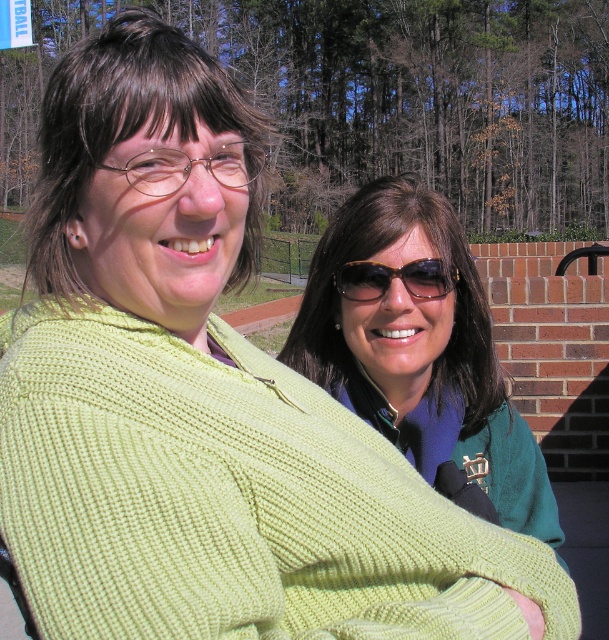
You are a photographer trying to capture a group photo of the two people in the image. The camera you are using has a minimum focusing distance of 3 inches. Can you include both the green knitted sweater at center and the black reflective sunglasses at center in the same focused shot?

The distance between the green knitted sweater at center and the black reflective sunglasses at center is 3.06 inches, which exceeds the camera minimum focusing distance of 3 inches. Therefore, both can be included in the focused shot.

You are a photographer adjusting your camera settings to capture the best shot of the green knitted sweater at center. The camera has a focal length of 50mm and an aperture of f2.8. To ensure the sweater is in sharp focus, what distance should you set the focus ring to?

The green knitted sweater at center is 4.84 feet away from camera, so you should set the focus ring to 4.84 feet to ensure it is in sharp focus.

You are a photographer trying to capture a clear shot of the black reflective sunglasses at center. However, the green knitted sweater at center is blocking your view. Can you adjust your position to avoid the obstruction?

The green knitted sweater at center is in front of the black reflective sunglasses at center, so moving your position slightly backward or to the side might allow you to see around the obstruction.